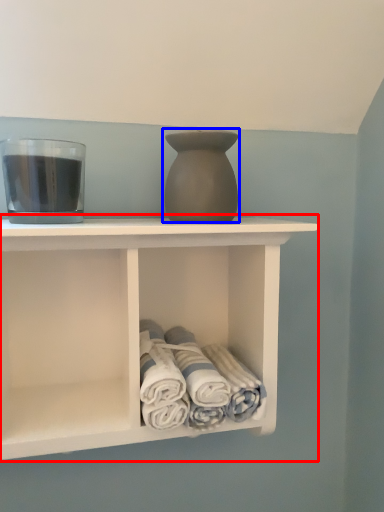
Question: Among these objects, which one is nearest to the camera, shelf (highlighted by a red box) or vase (highlighted by a blue box)?

Choices:
 (A) shelf
 (B) vase

Answer: (A)